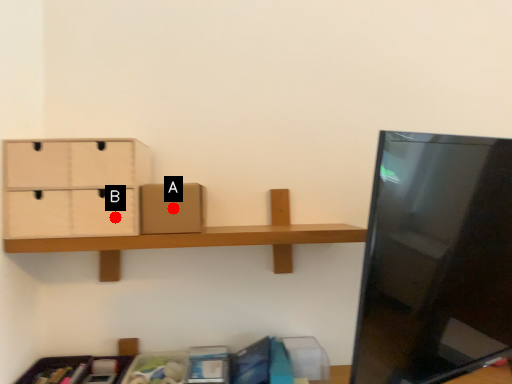
Question: Two points are circled on the image, labeled by A and B beside each circle. Among these points, which one is nearest to the camera?

Choices:
 (A) A is closer
 (B) B is closer

Answer: (B)